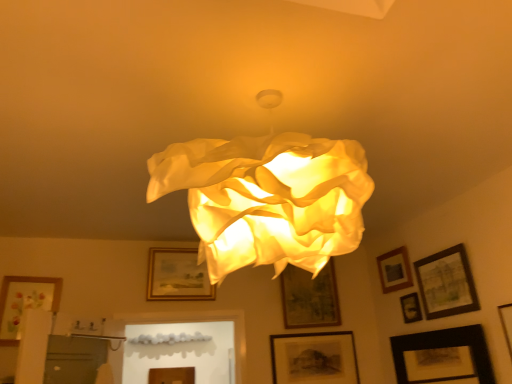
Locate an element on the screen. matte floral print picture frame at lower left, which is the tenth picture frame in right-to-left order is located at coordinates (25, 302).

What do you see at coordinates (172, 375) in the screenshot? This screenshot has width=512, height=384. I see `wooden picture frame at lower center, the 9th picture frame in the right-to-left sequence` at bounding box center [172, 375].

Locate an element on the screen. Image resolution: width=512 pixels, height=384 pixels. black matte picture frame at lower right, arranged as the eighth picture frame when viewed from the left is located at coordinates (442, 356).

What do you see at coordinates (446, 283) in the screenshot? I see `wooden framed picture at upper right, placed as the second picture frame when sorted from right to left` at bounding box center [446, 283].

What is the approximate height of wooden picture frame at upper right, the 5th picture frame viewed from the right?

10.80 inches.

The width and height of the screenshot is (512, 384). Describe the element at coordinates (394, 270) in the screenshot. I see `wooden picture frame at upper right, which appears as the 6th picture frame when viewed from the left` at that location.

The image size is (512, 384). In order to click on matte floral print picture frame at lower left, which is the tenth picture frame in right-to-left order in this screenshot , I will do `click(25, 302)`.

Does wooden framed picture at upper right, which is the ninth picture frame in left-to-right order, lie behind matte floral print picture frame at lower left, which is the tenth picture frame in right-to-left order?

No, wooden framed picture at upper right, which is the ninth picture frame in left-to-right order, is closer to the camera.

From a real-world perspective, is wooden framed picture at upper right, which is the ninth picture frame in left-to-right order, below matte floral print picture frame at lower left, the 1th picture frame viewed from the left?

No, from a real-world perspective, wooden framed picture at upper right, which is the ninth picture frame in left-to-right order, is not below matte floral print picture frame at lower left, the 1th picture frame viewed from the left.

Is wooden framed picture at upper right, which is the ninth picture frame in left-to-right order, situated inside matte floral print picture frame at lower left, the 1th picture frame viewed from the left, or outside?

The correct answer is: outside.

This screenshot has height=384, width=512. Find the location of `the 1st picture frame above the matte floral print picture frame at lower left, the 1th picture frame viewed from the left (from a real-world perspective)`. the 1st picture frame above the matte floral print picture frame at lower left, the 1th picture frame viewed from the left (from a real-world perspective) is located at coordinates (446, 283).

Between wooden picture frame at lower center, which is the 2th picture frame in left-to-right order, and matte floral print picture frame at lower left, which is the tenth picture frame in right-to-left order, which one has more height?

With more height is matte floral print picture frame at lower left, which is the tenth picture frame in right-to-left order.

Identify the location of the 6th picture frame behind the matte floral print picture frame at lower left, which is the tenth picture frame in right-to-left order. This screenshot has width=512, height=384. (172, 375).

How far apart are wooden picture frame at lower center, which is the 2th picture frame in left-to-right order, and matte floral print picture frame at lower left, the 1th picture frame viewed from the left?

A distance of 4.50 feet exists between wooden picture frame at lower center, which is the 2th picture frame in left-to-right order, and matte floral print picture frame at lower left, the 1th picture frame viewed from the left.

Is matte black picture frame at lower right, placed as the seventh picture frame when sorted from left to right, positioned far away from wooden framed picture at center, marked as the third picture frame in a left-to-right arrangement?

Yes, matte black picture frame at lower right, placed as the seventh picture frame when sorted from left to right, and wooden framed picture at center, marked as the third picture frame in a left-to-right arrangement, are quite far apart.

Is matte black picture frame at lower right, placed as the seventh picture frame when sorted from left to right, oriented away from wooden framed picture at center, placed as the eighth picture frame when sorted from right to left?

No, matte black picture frame at lower right, placed as the seventh picture frame when sorted from left to right, is not facing the opposite direction of wooden framed picture at center, placed as the eighth picture frame when sorted from right to left.

Which object is further away from the camera, matte black picture frame at lower right, placed as the seventh picture frame when sorted from left to right, or wooden framed picture at center, placed as the eighth picture frame when sorted from right to left?

wooden framed picture at center, placed as the eighth picture frame when sorted from right to left, is further from the camera.

Who is smaller, matte black picture frame at lower right, the 4th picture frame viewed from the right, or wooden framed picture at center, marked as the third picture frame in a left-to-right arrangement?

With smaller size is matte black picture frame at lower right, the 4th picture frame viewed from the right.

Is wooden picture frame at lower center, which is the 2th picture frame in left-to-right order, not within wooden framed picture at upper right, which is the ninth picture frame in left-to-right order?

Indeed, wooden picture frame at lower center, which is the 2th picture frame in left-to-right order, is completely outside wooden framed picture at upper right, which is the ninth picture frame in left-to-right order.

Can you tell me how much wooden picture frame at lower center, which is the 2th picture frame in left-to-right order, and wooden framed picture at upper right, placed as the second picture frame when sorted from right to left, differ in facing direction?

The angle between the facing direction of wooden picture frame at lower center, which is the 2th picture frame in left-to-right order, and the facing direction of wooden framed picture at upper right, placed as the second picture frame when sorted from right to left, is 90 degrees.

From the image's perspective, is wooden picture frame at lower center, which is the 2th picture frame in left-to-right order, beneath wooden framed picture at upper right, which is the ninth picture frame in left-to-right order?

Yes, from the image's perspective, wooden picture frame at lower center, which is the 2th picture frame in left-to-right order, is beneath wooden framed picture at upper right, which is the ninth picture frame in left-to-right order.

From a real-world perspective, which object stands above the other?

In real-world perspective, wooden framed picture at upper right, placed as the second picture frame when sorted from right to left, is above.

From a real-world perspective, which picture frame is the 1st one above the wooden picture frame at lower center, which is the 2th picture frame in left-to-right order? Please provide its 2D coordinates.

[(506, 324)]

Is wooden picture frame at lower right, the tenth picture frame positioned from the left, located within wooden picture frame at lower center, the 9th picture frame in the right-to-left sequence?

That's incorrect, wooden picture frame at lower right, the tenth picture frame positioned from the left, is not inside wooden picture frame at lower center, the 9th picture frame in the right-to-left sequence.

Is point (165, 371) in front of point (510, 356)?

No.

From the image's perspective, which one is positioned higher, wooden picture frame at lower center, the 9th picture frame in the right-to-left sequence, or wooden picture frame at lower right, the tenth picture frame positioned from the left?

wooden picture frame at lower right, the tenth picture frame positioned from the left, from the image's perspective.

Can we say black matte picture frame at lower center, the 5th picture frame viewed from the left, lies outside wooden picture frame at lower center, which is the 2th picture frame in left-to-right order?

Yes, black matte picture frame at lower center, the 5th picture frame viewed from the left, is outside of wooden picture frame at lower center, which is the 2th picture frame in left-to-right order.

Does black matte picture frame at lower center, positioned as the sixth picture frame in right-to-left order, have a greater width compared to wooden picture frame at lower center, which is the 2th picture frame in left-to-right order?

Yes, black matte picture frame at lower center, positioned as the sixth picture frame in right-to-left order, is wider than wooden picture frame at lower center, which is the 2th picture frame in left-to-right order.

Who is taller, black matte picture frame at lower center, positioned as the sixth picture frame in right-to-left order, or wooden picture frame at lower center, which is the 2th picture frame in left-to-right order?

wooden picture frame at lower center, which is the 2th picture frame in left-to-right order.

How distant is black matte picture frame at lower center, the 5th picture frame viewed from the left, from wooden picture frame at lower center, the 9th picture frame in the right-to-left sequence?

black matte picture frame at lower center, the 5th picture frame viewed from the left, is 1.22 meters from wooden picture frame at lower center, the 9th picture frame in the right-to-left sequence.

What's the angular difference between wooden picture frame at lower center, which is the 2th picture frame in left-to-right order, and wooden framed picture at center, marked as the third picture frame in a left-to-right arrangement,'s facing directions?

They differ by 0.179 degrees in their facing directions.

Considering the relative positions of wooden picture frame at lower center, which is the 2th picture frame in left-to-right order, and wooden framed picture at center, marked as the third picture frame in a left-to-right arrangement, in the image provided, is wooden picture frame at lower center, which is the 2th picture frame in left-to-right order, to the left or to the right of wooden framed picture at center, marked as the third picture frame in a left-to-right arrangement,?

wooden picture frame at lower center, which is the 2th picture frame in left-to-right order, is positioned on wooden framed picture at center, marked as the third picture frame in a left-to-right arrangement,'s left side.

Between wooden picture frame at lower center, the 9th picture frame in the right-to-left sequence, and wooden framed picture at center, marked as the third picture frame in a left-to-right arrangement, which one has more height?

wooden picture frame at lower center, the 9th picture frame in the right-to-left sequence, is taller.

From the image's perspective, is wooden picture frame at lower center, the 9th picture frame in the right-to-left sequence, above or below wooden framed picture at center, placed as the eighth picture frame when sorted from right to left?

From the image's perspective, wooden picture frame at lower center, the 9th picture frame in the right-to-left sequence, appears below wooden framed picture at center, placed as the eighth picture frame when sorted from right to left.

From the image's perspective, which picture frame is the 5th one below the wooden framed picture at upper right, placed as the second picture frame when sorted from right to left? Please provide its 2D coordinates.

[(25, 302)]

Starting from the wooden picture frame at lower center, which is the 2th picture frame in left-to-right order, which picture frame is the 6th one in front? Please provide its 2D coordinates.

[(25, 302)]

Based on their spatial positions, is wooden picture frame at upper right, the 5th picture frame viewed from the right, or wooden picture frame at lower center, the 9th picture frame in the right-to-left sequence, further from wooden framed picture at center, marked as the third picture frame in a left-to-right arrangement?

Based on the image, wooden picture frame at upper right, the 5th picture frame viewed from the right, appears to be further to wooden framed picture at center, marked as the third picture frame in a left-to-right arrangement.

Based on their spatial positions, is wooden framed picture at center, placed as the eighth picture frame when sorted from right to left, or wooden picture frame at lower right, which appears as the first picture frame when viewed from the right, closer to wooden picture frame at lower center, which is the 2th picture frame in left-to-right order?

wooden framed picture at center, placed as the eighth picture frame when sorted from right to left.

From the image, which object appears to be farther from matte floral print picture frame at lower left, which is the tenth picture frame in right-to-left order, wooden framed picture at center, placed as the eighth picture frame when sorted from right to left, or matte black picture frame at lower right, placed as the seventh picture frame when sorted from left to right?

The object further to matte floral print picture frame at lower left, which is the tenth picture frame in right-to-left order, is matte black picture frame at lower right, placed as the seventh picture frame when sorted from left to right.

Looking at the image, which one is located closer to wooden picture frame at upper right, the 5th picture frame viewed from the right, wooden framed picture at center, which appears as the 4th picture frame when viewed from the left, or black matte picture frame at lower right, the third picture frame in the right-to-left sequence?

black matte picture frame at lower right, the third picture frame in the right-to-left sequence.

From the image, which object appears to be farther from wooden framed picture at center, marked as the third picture frame in a left-to-right arrangement, matte black picture frame at lower right, the 4th picture frame viewed from the right, or wooden framed picture at center, which ranks as the 7th picture frame in right-to-left order?

Among the two, matte black picture frame at lower right, the 4th picture frame viewed from the right, is located further to wooden framed picture at center, marked as the third picture frame in a left-to-right arrangement.

Considering their positions, is black matte picture frame at lower right, the third picture frame in the right-to-left sequence, positioned closer to matte floral print picture frame at lower left, which is the tenth picture frame in right-to-left order, than matte black picture frame at lower right, the 4th picture frame viewed from the right?

matte black picture frame at lower right, the 4th picture frame viewed from the right, is closer to matte floral print picture frame at lower left, which is the tenth picture frame in right-to-left order.

Based on their spatial positions, is wooden framed picture at upper right, which is the ninth picture frame in left-to-right order, or wooden picture frame at lower center, which is the 2th picture frame in left-to-right order, further from wooden framed picture at center, placed as the eighth picture frame when sorted from right to left?

wooden framed picture at upper right, which is the ninth picture frame in left-to-right order, is positioned further to the anchor wooden framed picture at center, placed as the eighth picture frame when sorted from right to left.

Looking at the image, which one is located closer to wooden picture frame at lower center, which is the 2th picture frame in left-to-right order, matte floral print picture frame at lower left, which is the tenth picture frame in right-to-left order, or black matte picture frame at lower center, the 5th picture frame viewed from the left?

black matte picture frame at lower center, the 5th picture frame viewed from the left, lies closer to wooden picture frame at lower center, which is the 2th picture frame in left-to-right order, than the other object.

You are a GUI agent. You are given a task and a screenshot of the screen. Output one action in this format:
    pyautogui.click(x=<x>, y=<y>)
    Task: Click on the picture frame located between wooden framed picture at center, which appears as the 4th picture frame when viewed from the left, and wooden picture frame at upper right, which appears as the 6th picture frame when viewed from the left, in the left-right direction
    The width and height of the screenshot is (512, 384).
    Given the screenshot: What is the action you would take?
    pyautogui.click(x=314, y=358)

Identify the location of picture frame located between wooden picture frame at lower right, the tenth picture frame positioned from the left, and wooden framed picture at upper right, which is the ninth picture frame in left-to-right order, in the depth direction. The width and height of the screenshot is (512, 384). (442, 356).

This screenshot has height=384, width=512. I want to click on picture frame between wooden framed picture at center, placed as the eighth picture frame when sorted from right to left, and black matte picture frame at lower center, the 5th picture frame viewed from the left, from left to right, so click(309, 297).

Where is `picture frame between wooden picture frame at lower center, which is the 2th picture frame in left-to-right order, and wooden framed picture at center, which ranks as the 7th picture frame in right-to-left order, from left to right`? picture frame between wooden picture frame at lower center, which is the 2th picture frame in left-to-right order, and wooden framed picture at center, which ranks as the 7th picture frame in right-to-left order, from left to right is located at coordinates (177, 276).